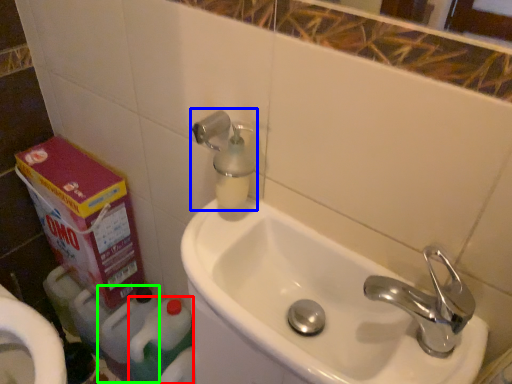
Question: Estimate the real-world distances between objects in this image. Which object is closer to cleaning product (highlighted by a red box), plumbing fixture (highlighted by a blue box) or cleaning product (highlighted by a green box)?

Choices:
 (A) plumbing fixture
 (B) cleaning product

Answer: (B)